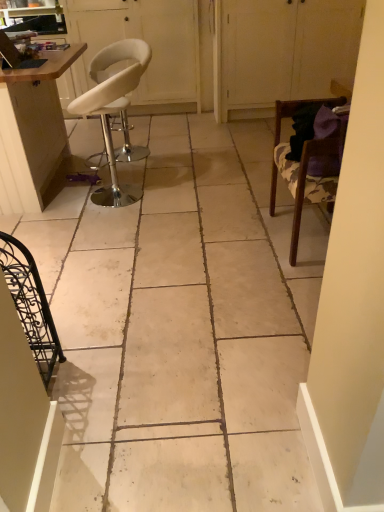
Locate an element on the screen. This screenshot has width=384, height=512. free area in between wooden chair at right, which is the second chair from front to back, and black wrought iron chair at lower left, the 1th chair from the left is located at coordinates pos(201,298).